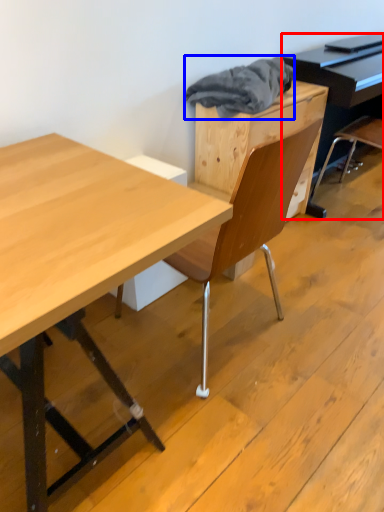
Question: Among these objects, which one is farthest to the camera, piano (highlighted by a red box) or material (highlighted by a blue box)?

Choices:
 (A) piano
 (B) material

Answer: (A)